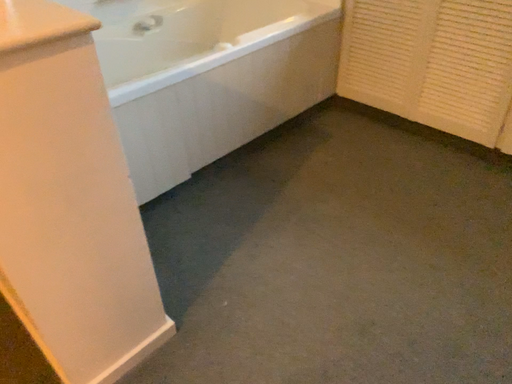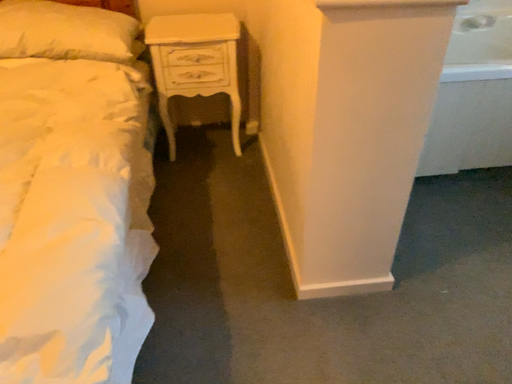
Question: How did the camera likely rotate when shooting the video?

Choices:
 (A) rotated upward
 (B) rotated downward

Answer: (A)